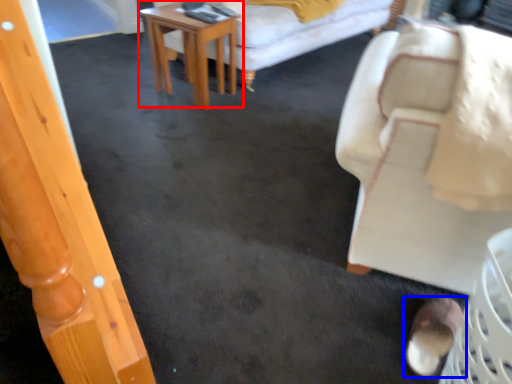
Question: Which object is further to the camera taking this photo, table (highlighted by a red box) or footwear (highlighted by a blue box)?

Choices:
 (A) table
 (B) footwear

Answer: (A)